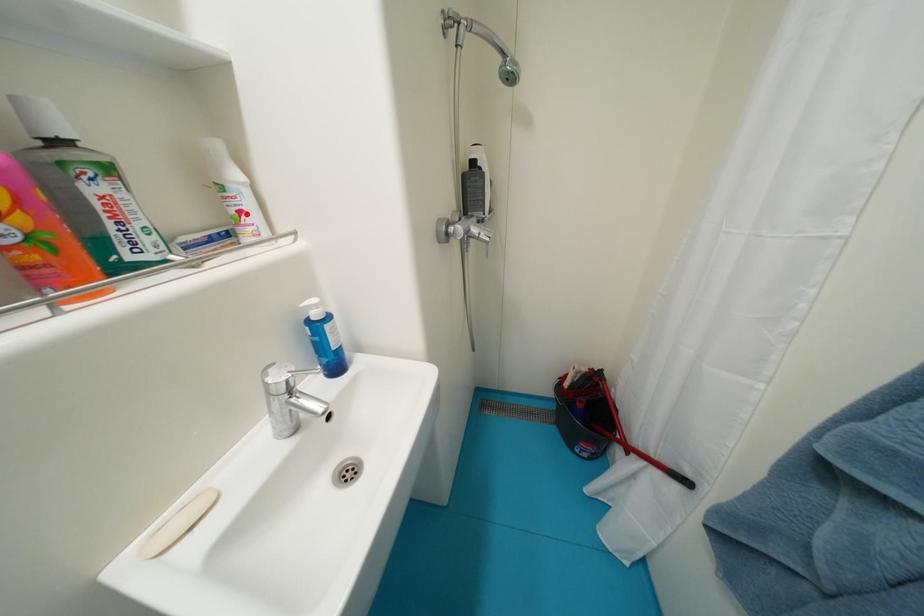
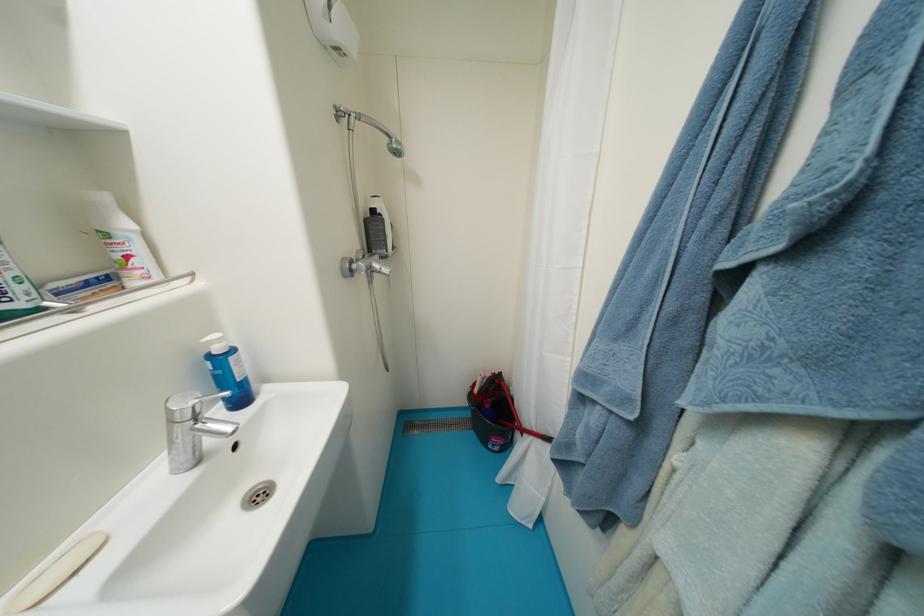
The point at the highlighted location is marked in the first image. Where is the corresponding point in the second image?

(134, 259)